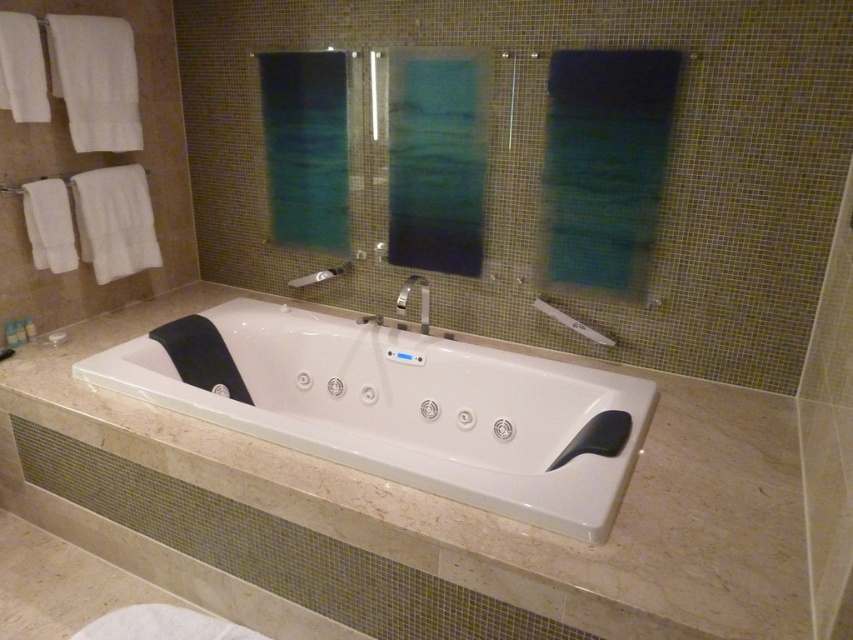
You are designing a bathroom layout and need to place a new shelf between the white glossy bathtub at center and the silver metallic towel bar at upper center. Which object should the shelf be placed closer to if the shelf must be narrower than both objects?

The shelf should be placed closer to the silver metallic towel bar at upper center because the white glossy bathtub at center is wider than the silver metallic towel bar at upper center, so the narrower space near the towel bar can accommodate a narrower shelf.

You are designing a bathroom layout and need to ensure that the silver metallic towel bar at upper center and the matte silver showerhead at center are spaced appropriately. Given that the towel bar is thinner, which object would require more horizontal space when installing?

The matte silver showerhead at center requires more horizontal space during installation because it is thicker than the silver metallic towel bar at upper center.

Looking at this image, you are designing a bathroom layout and need to place a new shelf between the white glossy bathtub at center and the matte silver showerhead at center. Which object should the shelf be closer to if it needs to be placed closer to the larger object?

The shelf should be placed closer to the white glossy bathtub at center because it is larger than the matte silver showerhead at center according to the description.